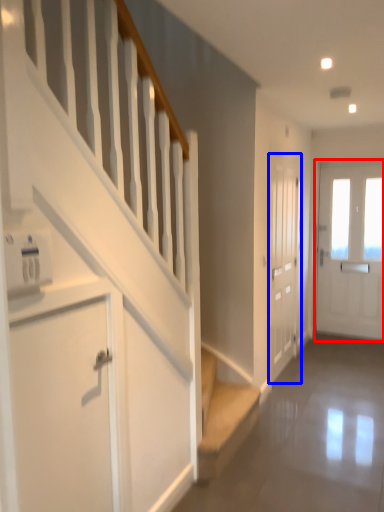
Question: Which point is further to the camera, door (highlighted by a red box) or door (highlighted by a blue box)?

Choices:
 (A) door
 (B) door

Answer: (A)